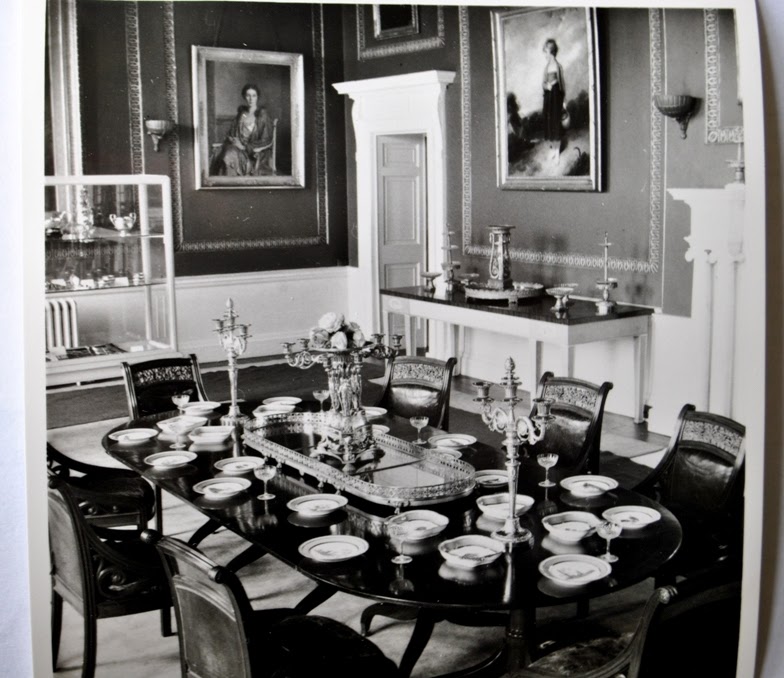
This screenshot has height=678, width=784. In order to click on doorframe in this screenshot , I will do `click(400, 127)`.